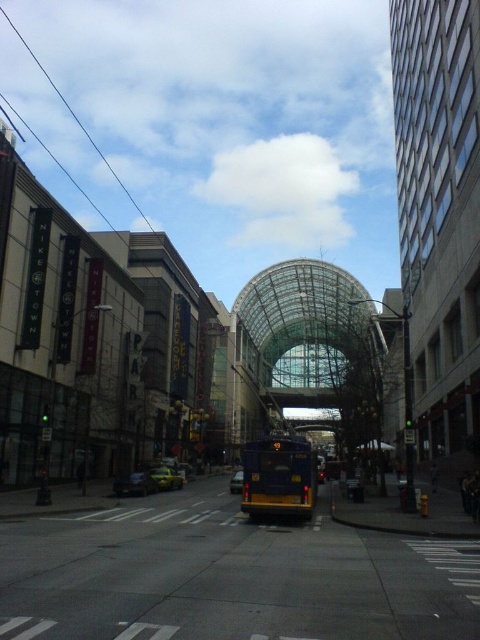
Is point (159, 470) positioned in front of point (241, 483)?

That is False.

Who is more distant from viewer, (180,476) or (241,486)?

Positioned behind is point (180,476).

You are a GUI agent. You are given a task and a screenshot of the screen. Output one action in this format:
    pyautogui.click(x=<x>, y=<y>)
    Task: Click on the yellow matte car at center
    The width and height of the screenshot is (480, 640).
    Given the screenshot: What is the action you would take?
    pyautogui.click(x=167, y=477)

Between metallic silver car at lower left and yellow matte car at center, which one appears on the left side from the viewer's perspective?

metallic silver car at lower left is more to the left.

Measure the distance between point (132, 477) and camera.

The distance of point (132, 477) from camera is 31.00 meters.

Where is `metallic silver car at lower left`? The image size is (480, 640). metallic silver car at lower left is located at coordinates (134, 484).

Does point (269, 452) come farther from viewer compared to point (155, 483)?

No, (269, 452) is in front of (155, 483).

Does yellow matte bus at center have a smaller size compared to yellow matte car at center?

No, yellow matte bus at center is not smaller than yellow matte car at center.

What do you see at coordinates (278, 477) in the screenshot?
I see `yellow matte bus at center` at bounding box center [278, 477].

Find the location of a particular element. Image resolution: width=480 pixels, height=640 pixels. yellow matte bus at center is located at coordinates (278, 477).